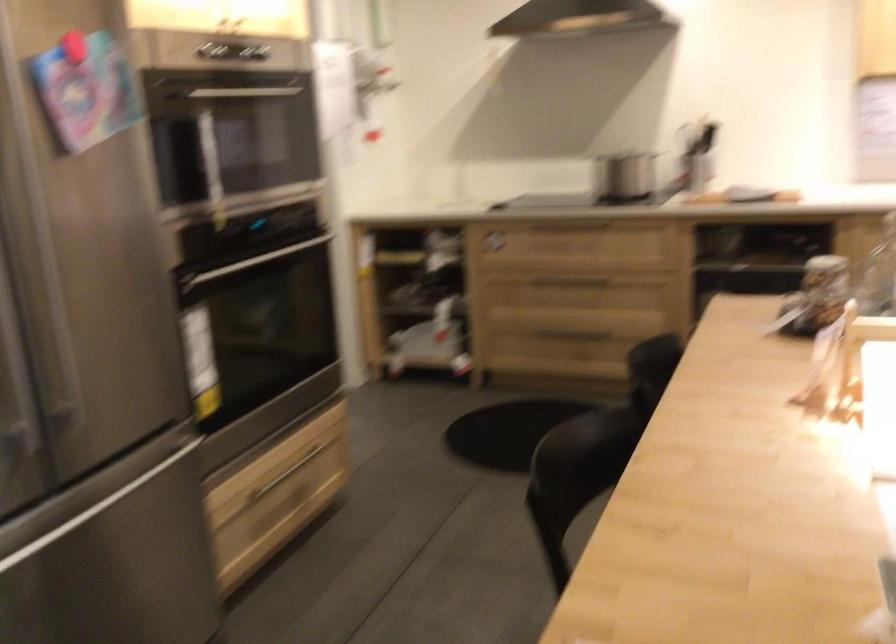
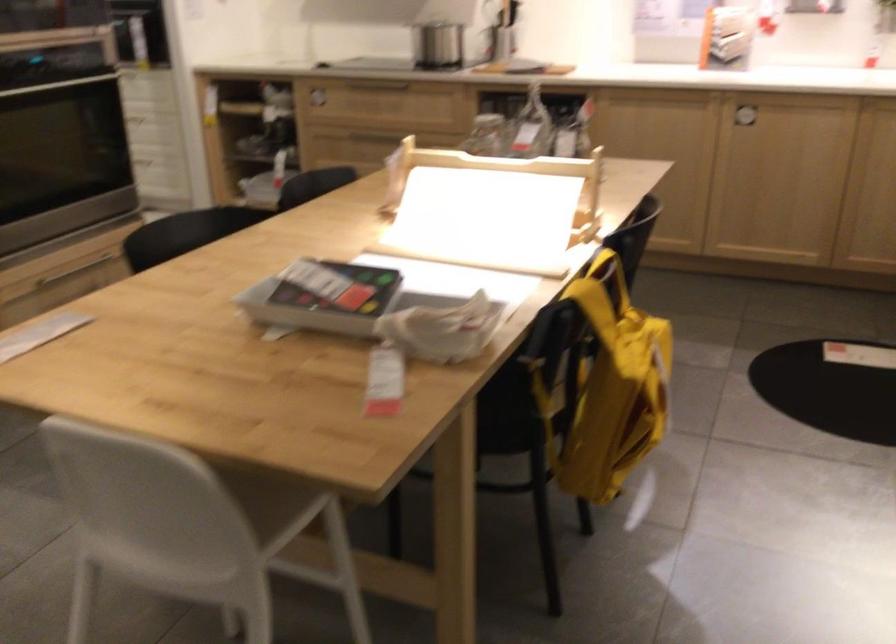
Find the pixel in the second image that matches (x=501, y=242) in the first image.

(316, 100)